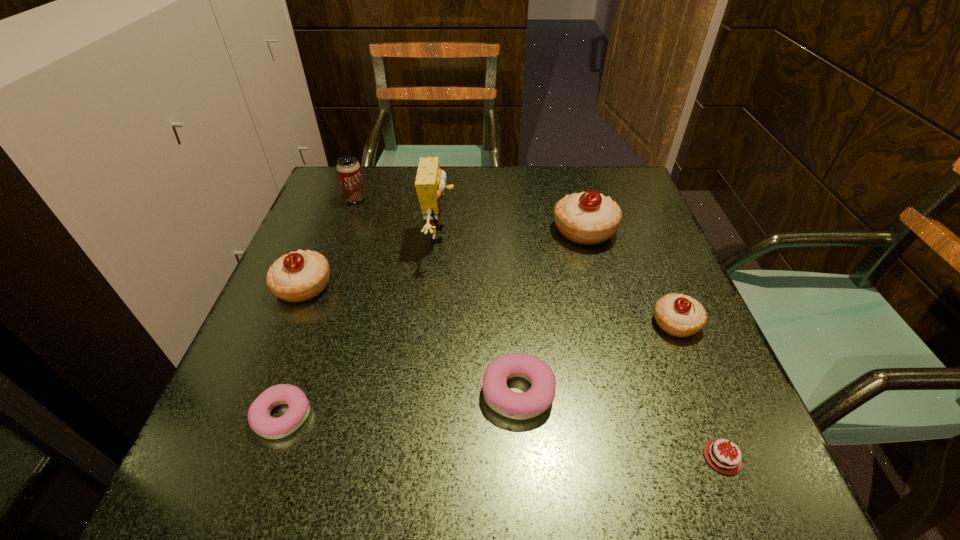
Image resolution: width=960 pixels, height=540 pixels. In order to click on vacant region between the farthest pastry and the tallest object in this screenshot , I will do `click(512, 232)`.

Locate an element on the screen. The width and height of the screenshot is (960, 540). free space between the farthest beige pastry and the fourth tallest pastry is located at coordinates (551, 311).

Locate an element on the screen. The width and height of the screenshot is (960, 540). vacant region between the shortest pastry and the beer can is located at coordinates (319, 307).

I want to click on vacant point located between the yellow sponge and the farthest pastry, so (x=512, y=232).

Locate an element on the screen. The width and height of the screenshot is (960, 540). free space between the farthest beige pastry and the second tallest pastry is located at coordinates (444, 258).

You are a GUI agent. You are given a task and a screenshot of the screen. Output one action in this format:
    pyautogui.click(x=<x>, y=<y>)
    Task: Click on the free space between the leftmost beige pastry and the red beer can
    The image size is (960, 540).
    Given the screenshot: What is the action you would take?
    pyautogui.click(x=329, y=242)

At what (x,y) coordinates should I click in order to perform the action: click on object identified as the closest to the second tallest pastry. Please return your answer as a coordinate pair (x, y). The width and height of the screenshot is (960, 540). Looking at the image, I should click on (430, 183).

Find the location of a particular element. The width and height of the screenshot is (960, 540). object that is the sixth nearest to the third shortest pastry is located at coordinates (299, 276).

Select which pastry is the fourth closest to the second biggest beige pastry. Please provide its 2D coordinates. Your answer should be formatted as a tuple, i.e. [(x, y)], where the tuple contains the x and y coordinates of a point satisfying the conditions above.

[(679, 315)]

Identify which pastry is the third nearest to the rightmost beige pastry. Please provide its 2D coordinates. Your answer should be formatted as a tuple, i.e. [(x, y)], where the tuple contains the x and y coordinates of a point satisfying the conditions above.

[(260, 421)]